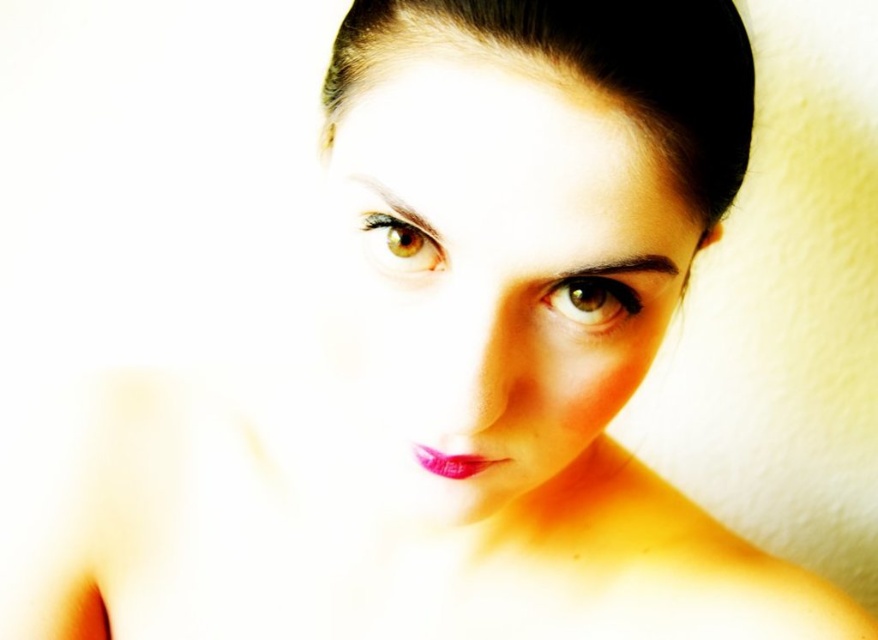
Is black shiny hair at upper center behind brown glossy eye at center?

No, black shiny hair at upper center is in front of brown glossy eye at center.

Consider the image. Which of these two, black shiny hair at upper center or brown glossy eye at center, stands shorter?

Standing shorter between the two is brown glossy eye at center.

Is point (393, 38) in front of point (555, 282)?

That is True.

You are a GUI agent. You are given a task and a screenshot of the screen. Output one action in this format:
    pyautogui.click(x=<x>, y=<y>)
    Task: Click on the black shiny hair at upper center
    The height and width of the screenshot is (640, 878).
    Given the screenshot: What is the action you would take?
    pyautogui.click(x=602, y=68)

Is brown matte eye at upper center thinner than shiny pink lipstick at center?

Answer: Correct, brown matte eye at upper center's width is less than shiny pink lipstick at center's.

Does brown matte eye at upper center appear on the left side of shiny pink lipstick at center?

Yes, brown matte eye at upper center is to the left of shiny pink lipstick at center.

What do you see at coordinates (400, 243) in the screenshot? I see `brown matte eye at upper center` at bounding box center [400, 243].

Where is `brown matte eye at upper center`? brown matte eye at upper center is located at coordinates (400, 243).

Consider the image. Which is more to the left, brown glossy eye at center or shiny pink lipstick at center?

shiny pink lipstick at center

Where is `brown glossy eye at center`? The height and width of the screenshot is (640, 878). brown glossy eye at center is located at coordinates (589, 301).

Which is in front, point (540, 298) or point (472, 458)?

Positioned in front is point (540, 298).

Where is `brown glossy eye at center`? Image resolution: width=878 pixels, height=640 pixels. brown glossy eye at center is located at coordinates (589, 301).